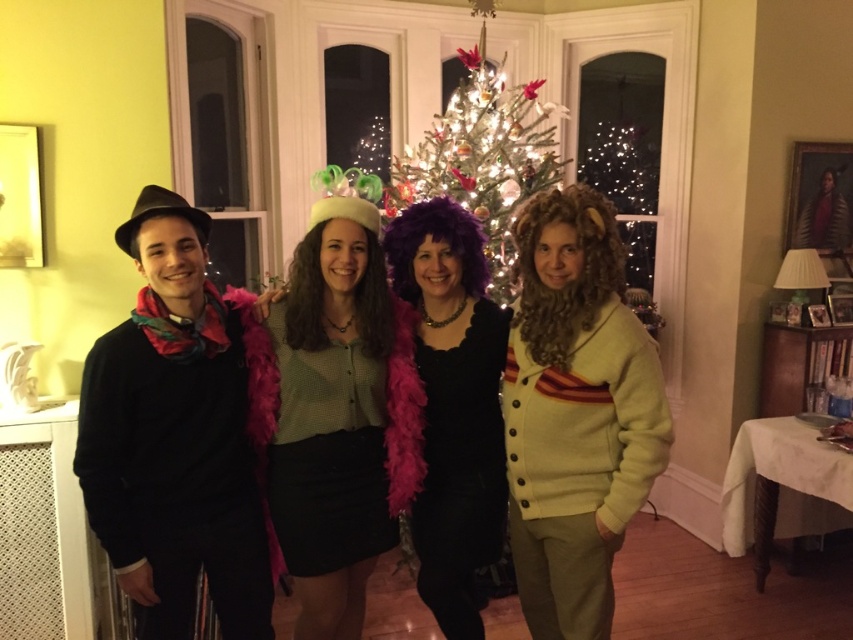
In the festive indoor scene with a Christmas tree in the background, there are four people dressed in costumes. The first person wears a black outfit with a red scarf and black hat, the second has a green top and black skirt, and the third is wearing a light yellow cardigan at right. Which of these three individuals is positioned furthest to the right?

The third individual wearing the light yellow cardigan at right is positioned furthest to the right as their cardigan is located at point (x=575, y=413), which is the rightmost coordinate among the three described.

Based on the photo, you are organizing a costume party and need to ensure that all accessories are visible in photos. You have a matte green blouse at center and a purple feather boa at center. Which item should you prioritize placing in the foreground to ensure it doesn not get lost in the background?

The matte green blouse at center should be prioritized in the foreground since its width is larger than the purple feather boa at center, making it more likely to stand out when placed closer to the camera.

You are organizing a photo shoot and need to ensure that the matte green blouse at center and the purple feather boa at center are both visible in the frame. Based on their sizes, which one might require more space vertically to be fully captured?

The purple feather boa at center requires more vertical space because it is taller than the matte green blouse at center.